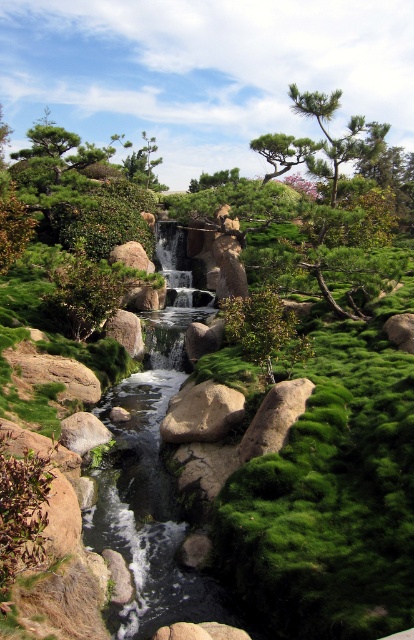
Question: Among these objects, which one is nearest to the camera?

Choices:
 (A) green mossy tree at upper left
 (B) green mossy rock at center

Answer: (B)

Question: Which point is closer to the camera taking this photo?

Choices:
 (A) (197, 436)
 (B) (35, 131)
 (C) (305, 387)

Answer: (C)

Question: Does green mossy tree at upper left appear over gray rock at center?

Choices:
 (A) yes
 (B) no

Answer: (A)

Question: Is green mossy tree at upper left closer to the viewer compared to green mossy rock at center?

Choices:
 (A) yes
 (B) no

Answer: (B)

Question: Which of the following is the farthest from the observer?

Choices:
 (A) green mossy rock at center
 (B) gray rock at center
 (C) green mossy tree at upper left

Answer: (C)

Question: Considering the relative positions of green mossy tree at upper left and green mossy rock at center in the image provided, where is green mossy tree at upper left located with respect to green mossy rock at center?

Choices:
 (A) right
 (B) left

Answer: (B)